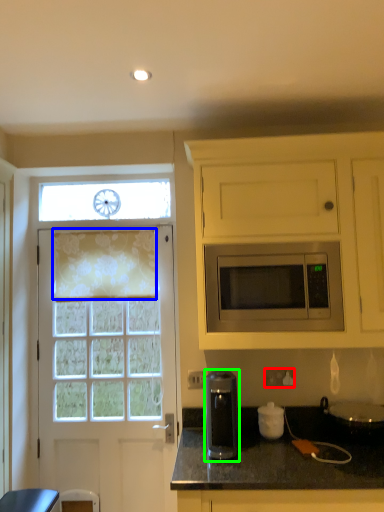
Question: Considering the real-world distances, which object is closest to electric outlet (highlighted by a red box)? curtain (highlighted by a blue box) or coffee machine (highlighted by a green box).

Choices:
 (A) curtain
 (B) coffee machine

Answer: (B)